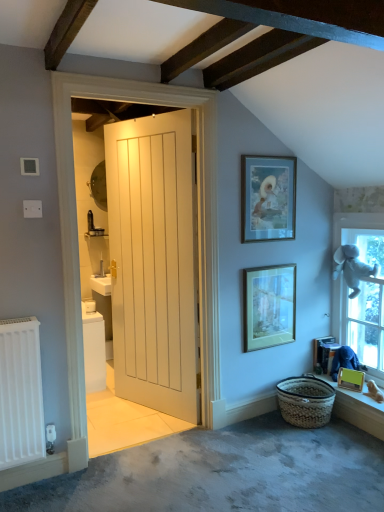
Locate an element on the screen. vacant area on top of wooden window sill at lower right (from a real-world perspective) is located at coordinates (352, 387).